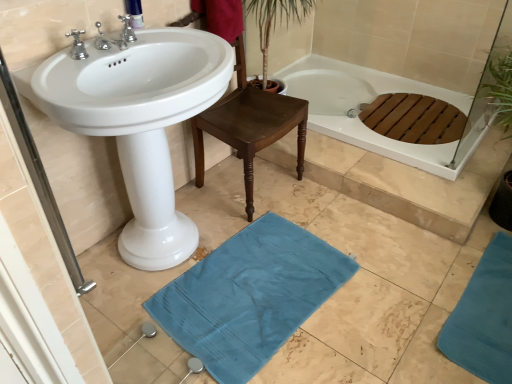
Question: Is teal fabric bath mat at lower right, which is the first bath mat from right to left, further to the viewer compared to white glossy sink at center?

Choices:
 (A) no
 (B) yes

Answer: (B)

Question: Is teal fabric bath mat at lower right, the second bath mat when ordered from left to right, bigger than white glossy sink at center?

Choices:
 (A) no
 (B) yes

Answer: (A)

Question: From a real-world perspective, is teal fabric bath mat at lower right, the second bath mat when ordered from left to right, physically below white glossy sink at center?

Choices:
 (A) yes
 (B) no

Answer: (A)

Question: Can you confirm if teal fabric bath mat at lower right, the second bath mat when ordered from left to right, is smaller than white glossy sink at center?

Choices:
 (A) no
 (B) yes

Answer: (B)

Question: From the image's perspective, is teal fabric bath mat at lower right, the second bath mat when ordered from left to right, on white glossy sink at center?

Choices:
 (A) no
 (B) yes

Answer: (A)

Question: Would you say blue fabric bath mat at lower center, the second bath mat viewed from the right, is to the left or to the right of polished chrome faucet at upper center, which appears as the second tap when viewed from the front, in the picture?

Choices:
 (A) right
 (B) left

Answer: (A)

Question: Is blue fabric bath mat at lower center, the 1th bath mat when ordered from left to right, bigger or smaller than polished chrome faucet at upper center, which ranks as the first tap in back-to-front order?

Choices:
 (A) small
 (B) big

Answer: (B)

Question: From a real-world perspective, relative to polished chrome faucet at upper center, which ranks as the first tap in back-to-front order, is blue fabric bath mat at lower center, the second bath mat viewed from the right, vertically above or below?

Choices:
 (A) below
 (B) above

Answer: (A)

Question: From their relative heights in the image, would you say blue fabric bath mat at lower center, the 1th bath mat when ordered from left to right, is taller or shorter than polished chrome faucet at upper center, which ranks as the first tap in back-to-front order?

Choices:
 (A) tall
 (B) short

Answer: (B)

Question: In terms of width, does satin nickel faucet at upper left, acting as the first tap starting from the front, look wider or thinner when compared to white glossy sink at center?

Choices:
 (A) wide
 (B) thin

Answer: (B)

Question: Is point (114, 39) positioned closer to the camera than point (170, 117)?

Choices:
 (A) farther
 (B) closer

Answer: (A)

Question: Looking at the image, does satin nickel faucet at upper left, the 2th tap positioned from the back, seem bigger or smaller compared to white glossy sink at center?

Choices:
 (A) small
 (B) big

Answer: (A)

Question: From the image's perspective, is satin nickel faucet at upper left, the 2th tap positioned from the back, positioned above or below white glossy sink at center?

Choices:
 (A) below
 (B) above

Answer: (B)

Question: Considering the positions of polished chrome faucet at upper center, which ranks as the first tap in back-to-front order, and white glossy sink at center in the image, is polished chrome faucet at upper center, which ranks as the first tap in back-to-front order, wider or thinner than white glossy sink at center?

Choices:
 (A) wide
 (B) thin

Answer: (B)

Question: Looking at the image, does polished chrome faucet at upper center, which appears as the second tap when viewed from the front, seem bigger or smaller compared to white glossy sink at center?

Choices:
 (A) small
 (B) big

Answer: (A)